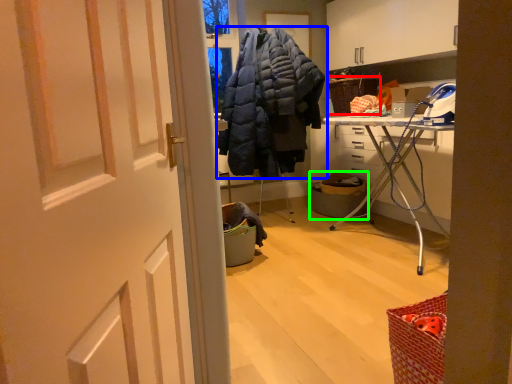
Question: Estimate the real-world distances between objects in this image. Which object is farther from picnic basket (highlighted by a red box), jacket (highlighted by a blue box) or laundry basket (highlighted by a green box)?

Choices:
 (A) jacket
 (B) laundry basket

Answer: (A)